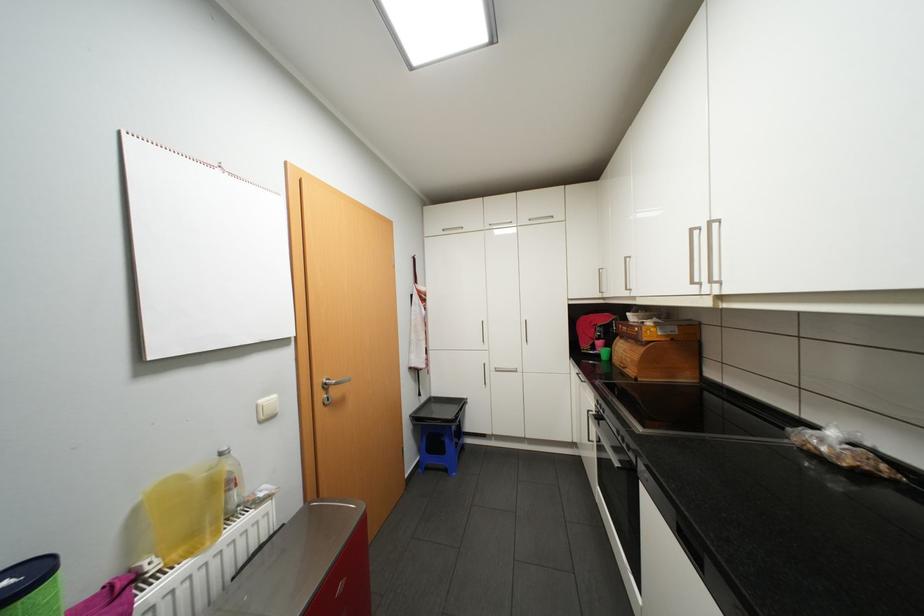
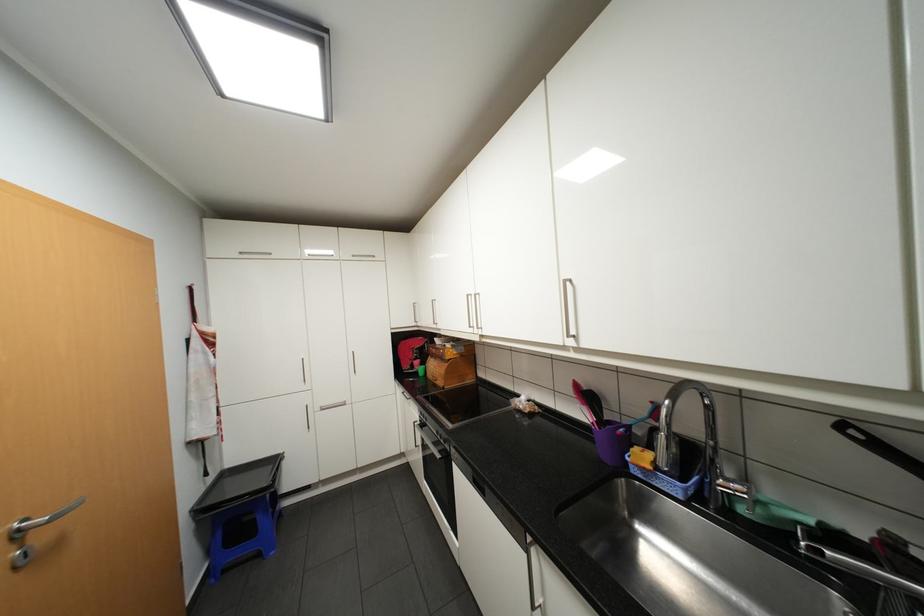
The point at (x=629, y=337) is marked in the first image. Where is the corresponding point in the second image?

(440, 355)